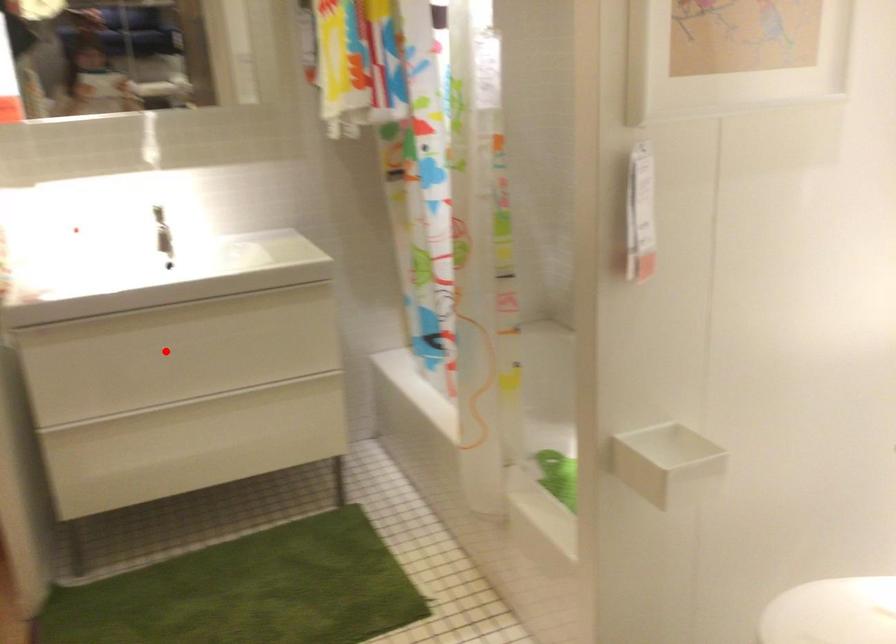
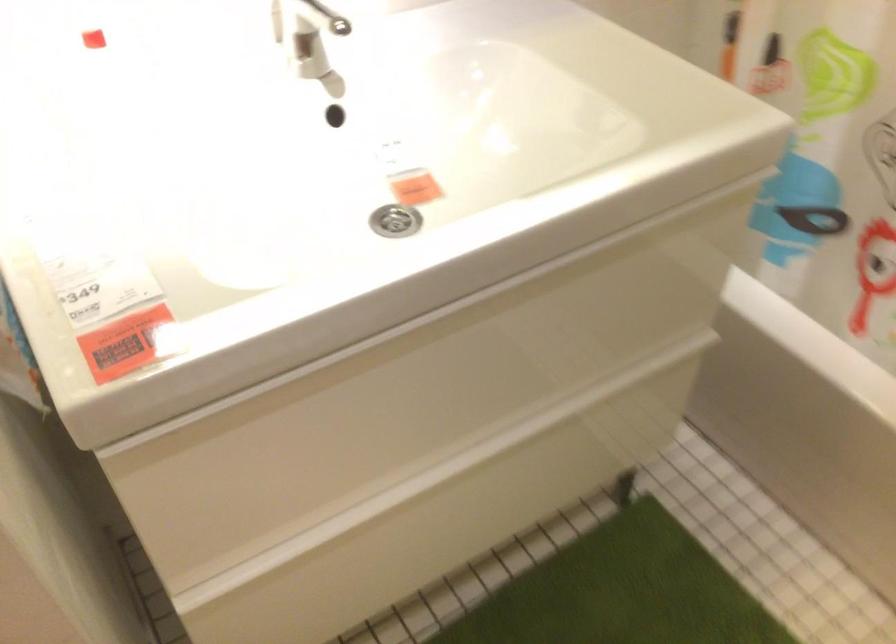
Question: I am providing you with two images of the same scene from different viewpoints. A red point is shown in image1. For the corresponding object point in image2, is it positioned nearer or farther from the camera?

Choices:
 (A) Nearer
 (B) Farther

Answer: (A)